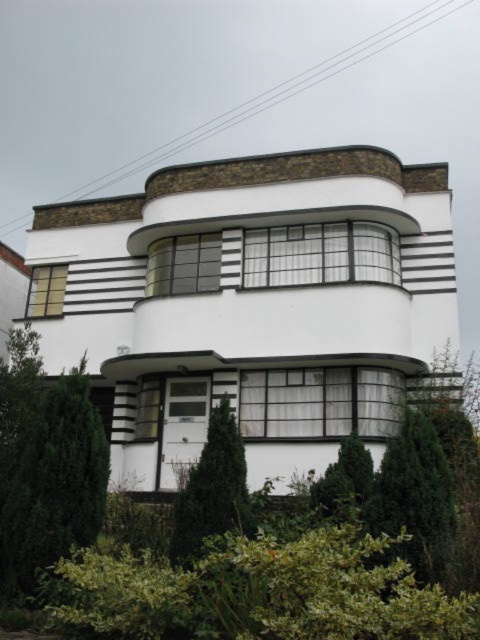
You are standing in front of the Art Deco building and want to take a photo of the green leafy tree at lower left without the green leafy bush at center blocking the view. Which direction should you move to achieve this?

You should move to the right of the green leafy tree at lower left to avoid the green leafy bush at center, which is positioned behind the tree from the current viewpoint.

You are standing in front of the Art Deco building and notice two plants. The green leafy tree at lower left and the green leafy bush at center. Which one is positioned higher up on the building?

The green leafy tree at lower left is located above the green leafy bush at center, so it is positioned higher up on the building.

From the picture: You are an architect designing a garden layout for the Art Deco building. You have two plants to place in the garden area. The green leafy tree at lower left and the green leafy bush at center. Which plant should you choose if you want to fill a larger area with foliage?

The green leafy bush at center should be chosen because it occupies more space than the green leafy tree at lower left.